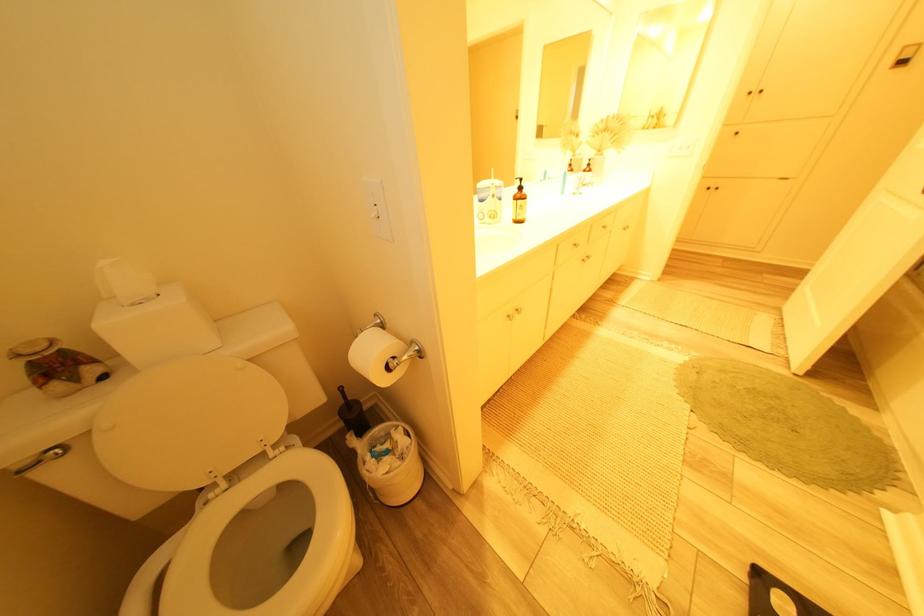
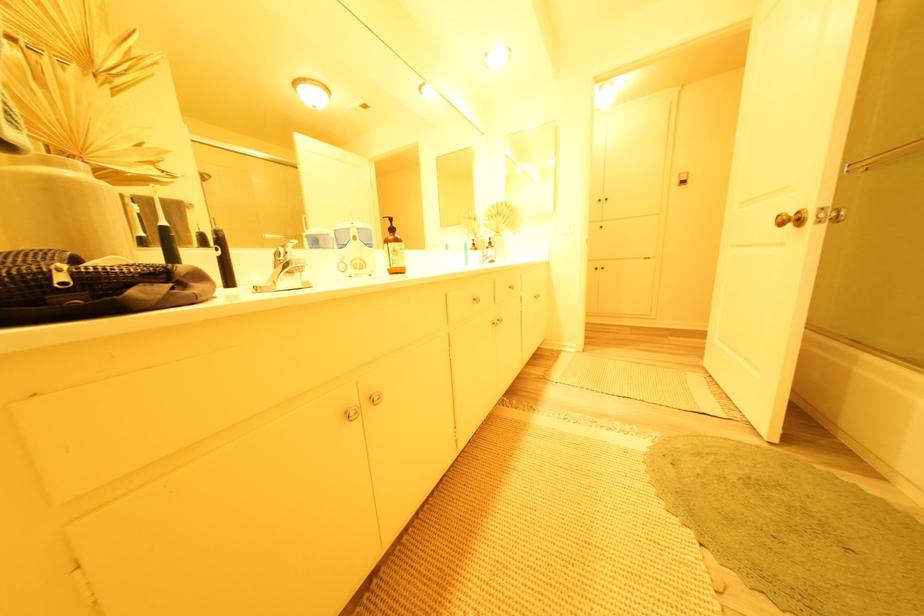
The images are taken continuously from a first-person perspective. In which direction are you moving?

A: The cameraman walked toward right, forward.